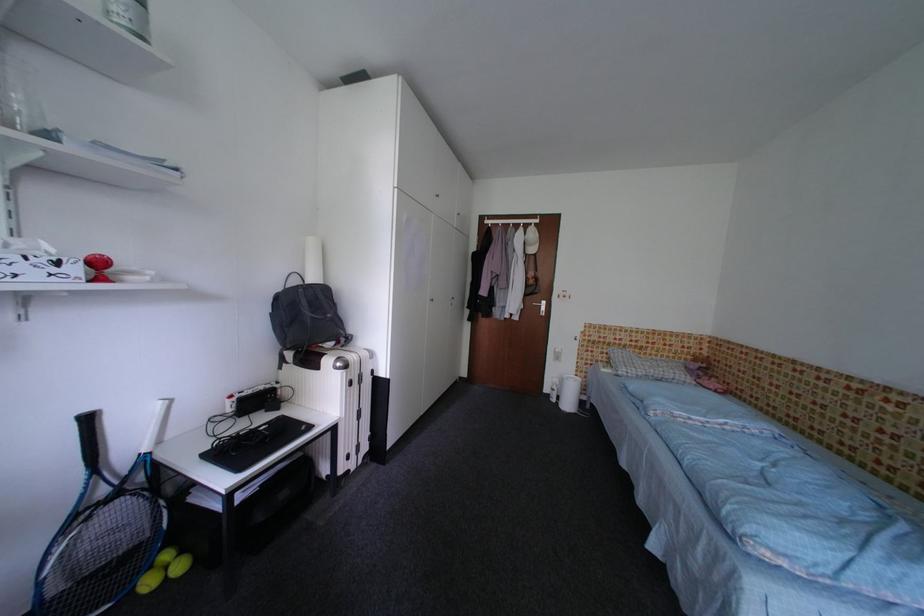
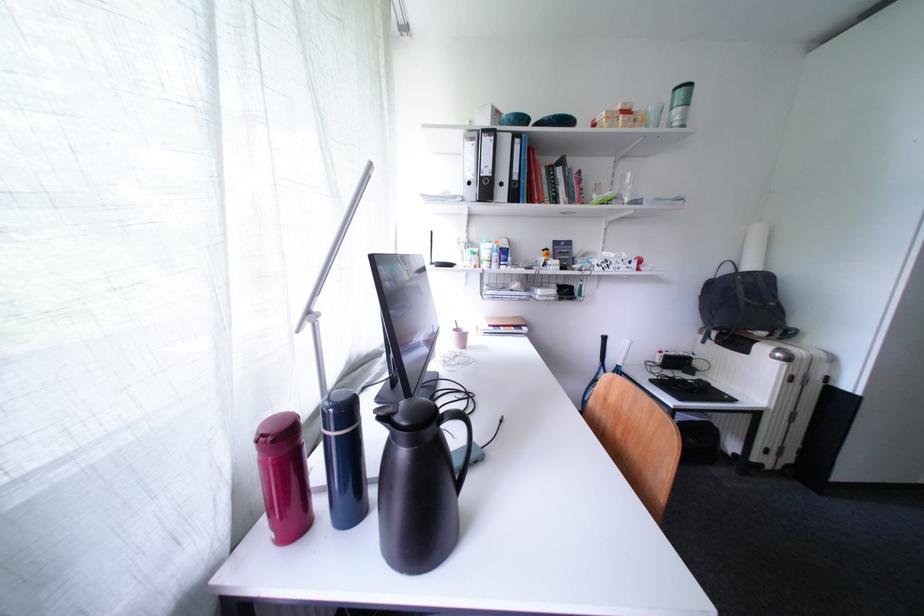
Question: The camera is either moving clockwise (left) or counter-clockwise (right) around the object. The first image is from the beginning of the video and the second image is from the end. Is the camera moving left or right when shooting the video?

Choices:
 (A) Left
 (B) Right

Answer: (B)